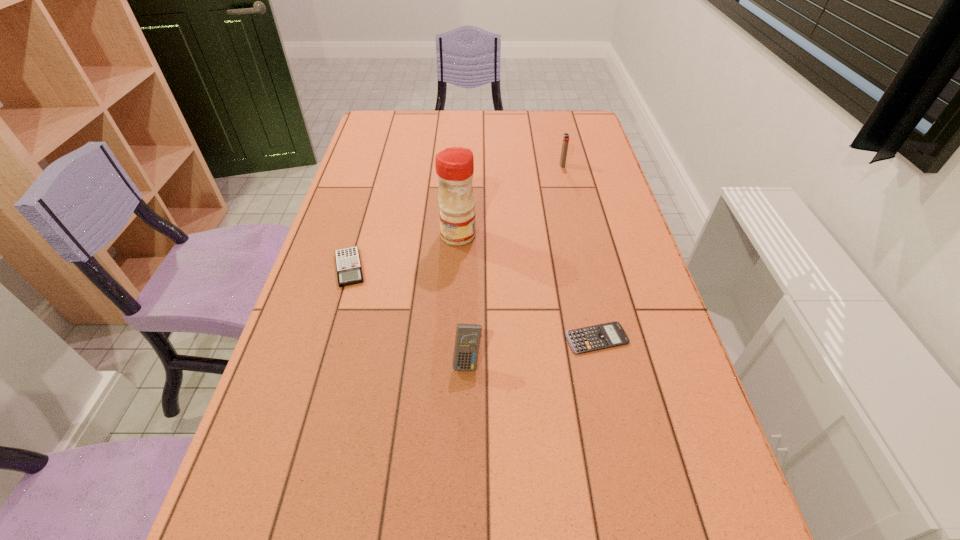
Locate an element on the screen. The width and height of the screenshot is (960, 540). vacant point located between the tallest calculator and the fourth tallest object is located at coordinates (408, 315).

Find the location of a particular element. free space between the rightmost calculator and the farthest object is located at coordinates (580, 252).

Find the location of a particular element. This screenshot has height=540, width=960. free space that is in between the tallest object and the igniter is located at coordinates (510, 200).

At what (x,y) coordinates should I click in order to perform the action: click on free spot between the second calculator from right to left and the farthest object. Please return your answer as a coordinate pair (x, y). The image size is (960, 540). Looking at the image, I should click on (515, 264).

Where is `vacant space that is in between the shortest calculator and the third farthest object`? The image size is (960, 540). vacant space that is in between the shortest calculator and the third farthest object is located at coordinates (473, 303).

Identify the location of free space that is in between the second calculator from left to right and the shortest calculator. (532, 350).

Locate an element on the screen. This screenshot has height=540, width=960. vacant region between the second calculator from left to right and the shortest object is located at coordinates (532, 350).

The height and width of the screenshot is (540, 960). I want to click on blank region between the tallest object and the igniter, so click(x=510, y=200).

Identify which object is the nearest to the tallest calculator. Please provide its 2D coordinates. Your answer should be formatted as a tuple, i.e. [(x, y)], where the tuple contains the x and y coordinates of a point satisfying the conditions above.

[(592, 338)]

Choose which object is the third nearest neighbor to the shortest object. Please provide its 2D coordinates. Your answer should be formatted as a tuple, i.e. [(x, y)], where the tuple contains the x and y coordinates of a point satisfying the conditions above.

[(348, 264)]